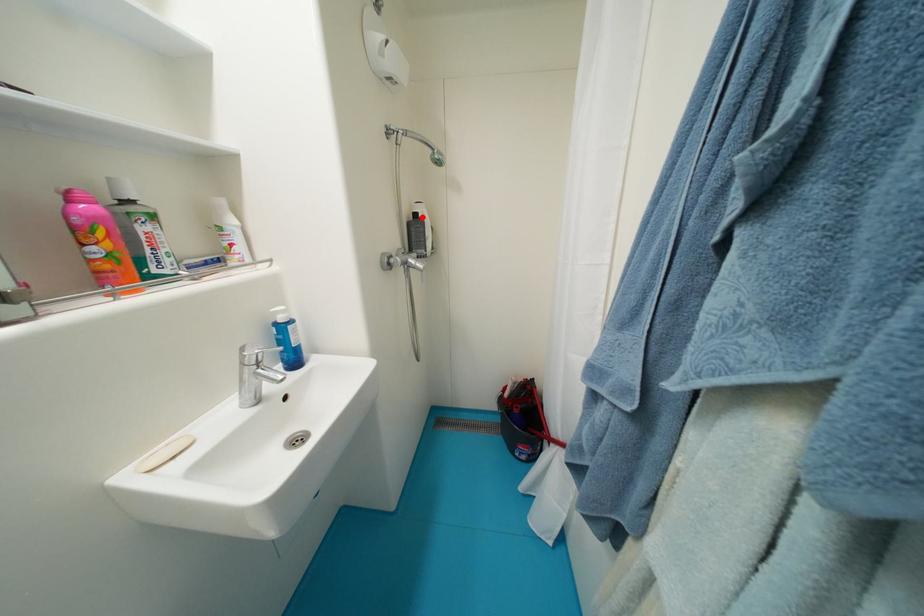
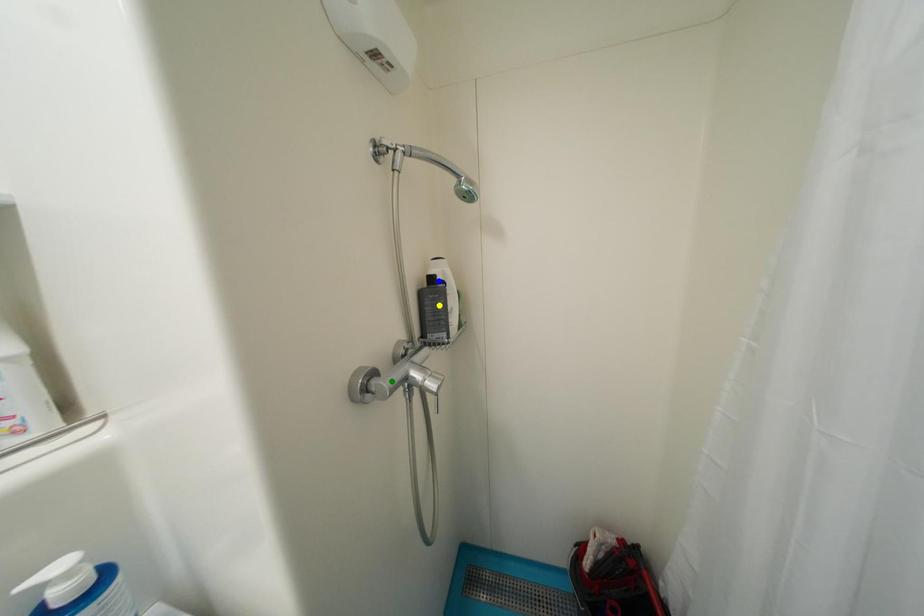
Question: I am providing you with two images of the same scene from different viewpoints. A red point is marked on the first image. You are given multiple points on the second image. Can you choose the point in image 2 that corresponds to the point in image 1?

Choices:
 (A) blue point
 (B) yellow point
 (C) green point

Answer: (A)